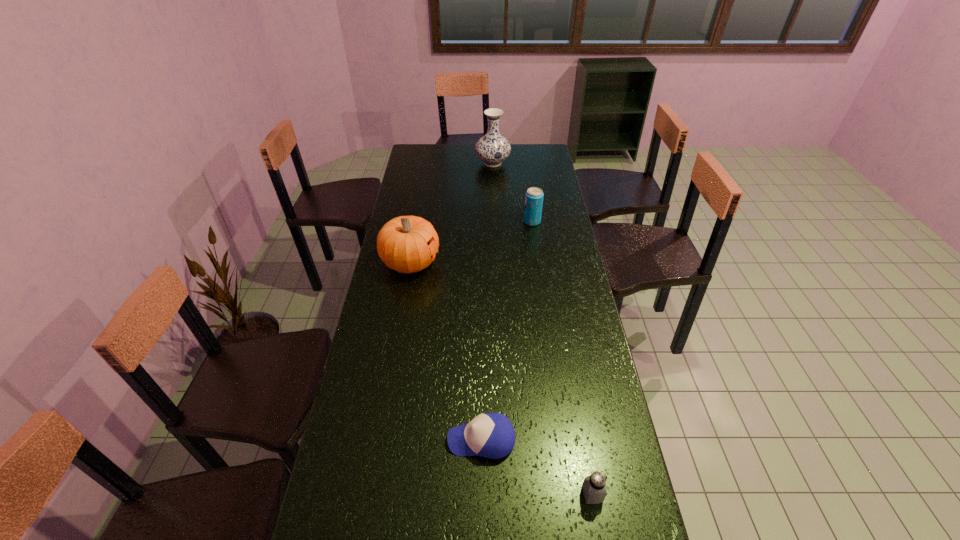
Identify the location of object that is the third nearest to the vase. (491, 435).

Locate an element on the screen. the third closest object to the vase is located at coordinates (491, 435).

Find the location of a particular element. This screenshot has height=540, width=960. free space in the image that satisfies the following two spatial constraints: 1. on the back side of the saltshaker; 2. on the front-facing side of the pumpkin is located at coordinates (551, 262).

Find the location of a particular element. free region that satisfies the following two spatial constraints: 1. on the front side of the second farthest object; 2. on the front-facing side of the baseball cap is located at coordinates (564, 440).